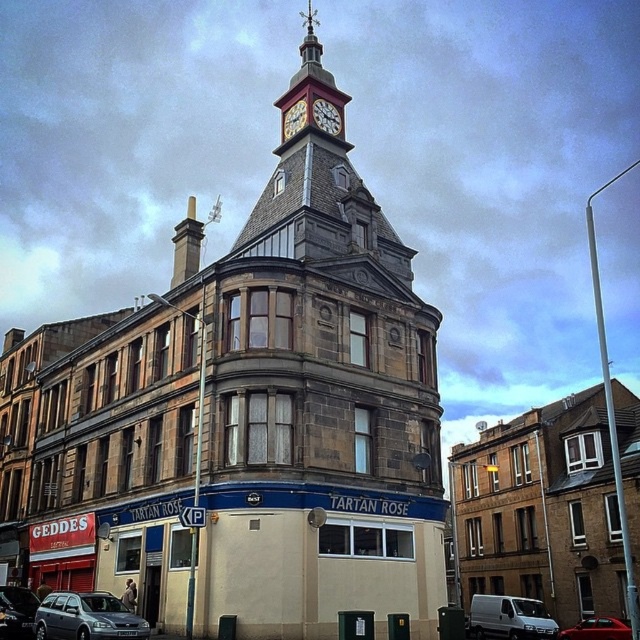
Looking at the building, where is the stone clock tower at center in relation to the wooden clock face at upper center?

The stone clock tower at center is to the left of the wooden clock face at upper center.

You are a pedestrian standing in front of the corner building with the clock tower. You want to cross the street but need to check if there is space between the metallic gray station wagon at lower left and the shiny black car at lower left for a bicycle to pass through. Is there enough space?

The metallic gray station wagon at lower left is in front of the shiny black car at lower left, so there is space between them for a bicycle to pass through.

You are a delivery driver who needs to park your vehicle in the parking spot next to the building. The parking spot is only tall enough for vehicles under 5 feet. You see the metallic gray station wagon at lower left and the shiny black car at lower left. Which vehicle can safely park there?

The metallic gray station wagon at lower left is taller than the shiny black car at lower left. Since the parking spot requires vehicles under 5 feet, the shiny black car at lower left can safely park there as it is shorter than the station wagon.